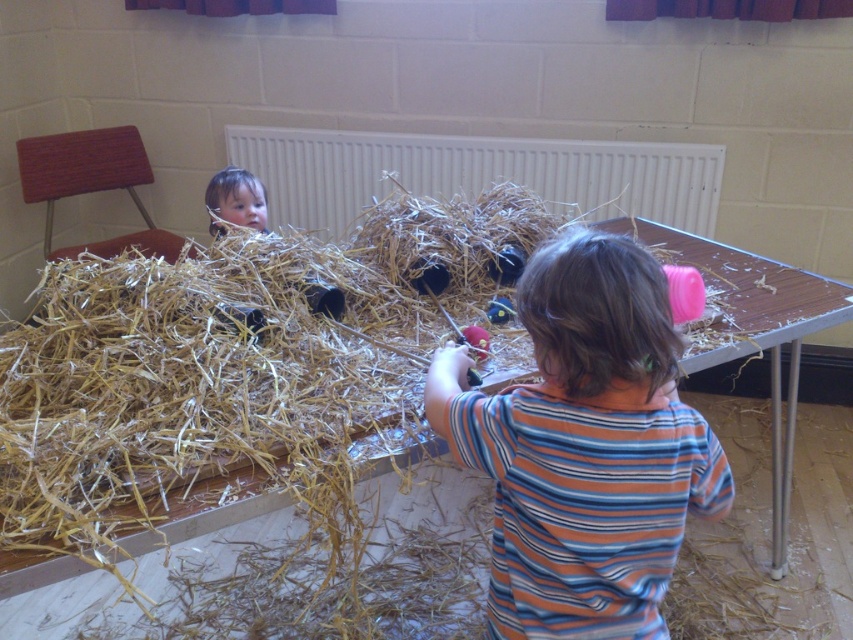
Does natural straw at center have a lesser height compared to striped cotton shirt at center?

No.

Does point (82, 436) lie behind point (512, 419)?

That is True.

Between point (103, 417) and point (630, 369), which one is positioned behind?

The point (103, 417) is more distant.

Locate an element on the screen. natural straw at center is located at coordinates (195, 380).

Is white matte radiator at upper center closer to the viewer compared to smooth brown hair at upper left?

No, it is behind smooth brown hair at upper left.

Who is more distant from viewer, [302,180] or [218,195]?

Positioned behind is point [302,180].

At what (x,y) coordinates should I click in order to perform the action: click on white matte radiator at upper center. Please return your answer as a coordinate pair (x, y). This screenshot has height=640, width=853. Looking at the image, I should click on (474, 173).

Who is shorter, striped cotton shirt at center or white matte radiator at upper center?

white matte radiator at upper center

Does point (576, 515) lie in front of point (451, 163)?

Yes, point (576, 515) is in front of point (451, 163).

Locate an element on the screen. This screenshot has height=640, width=853. striped cotton shirt at center is located at coordinates (585, 448).